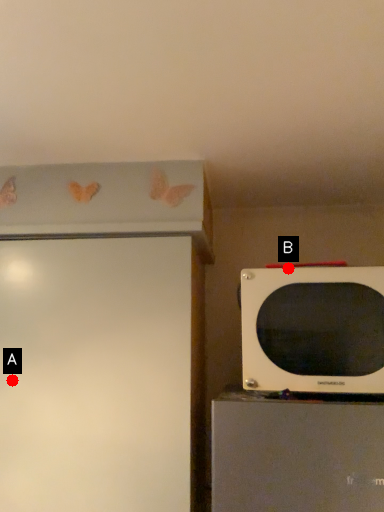
Question: Two points are circled on the image, labeled by A and B beside each circle. Which point is farther to the camera?

Choices:
 (A) A is further
 (B) B is further

Answer: (A)